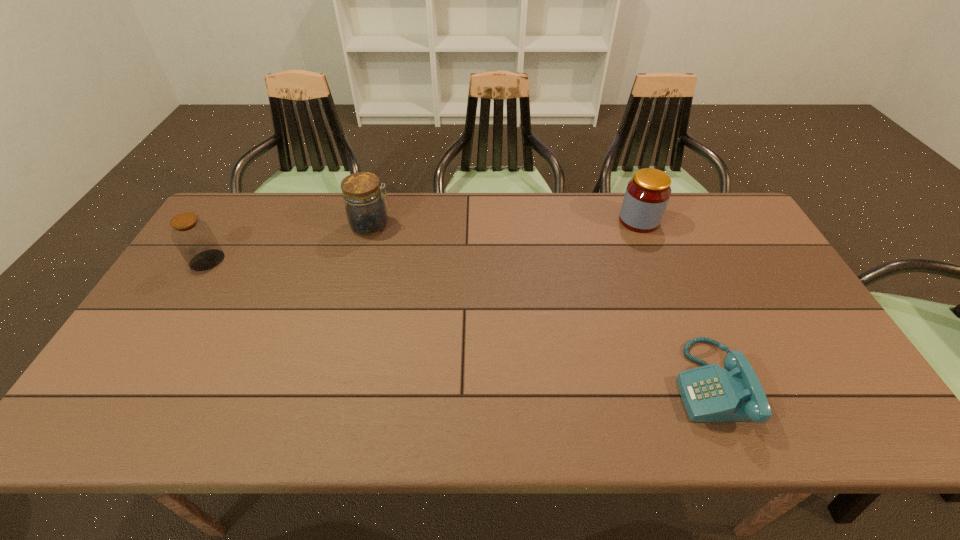
What are the coordinates of `vacant space at the far right corner of the desktop` in the screenshot? It's located at (685, 202).

This screenshot has width=960, height=540. In order to click on free space at the near right corner of the desktop in this screenshot , I will do `click(851, 404)`.

The height and width of the screenshot is (540, 960). Find the location of `free point between the second nearest object and the telephone`. free point between the second nearest object and the telephone is located at coordinates (459, 322).

Where is `free point between the nearest jar and the rightmost jar`? This screenshot has height=540, width=960. free point between the nearest jar and the rightmost jar is located at coordinates pos(423,240).

At what (x,y) coordinates should I click in order to perform the action: click on free space that is in between the shortest object and the nearest jar. Please return your answer as a coordinate pair (x, y). The image size is (960, 540). Looking at the image, I should click on (459, 322).

Where is `free space between the second object from left to right and the leftmost object`? The height and width of the screenshot is (540, 960). free space between the second object from left to right and the leftmost object is located at coordinates (289, 243).

Where is `free space that is in between the rightmost jar and the second object from left to right`? This screenshot has height=540, width=960. free space that is in between the rightmost jar and the second object from left to right is located at coordinates (505, 223).

The width and height of the screenshot is (960, 540). In order to click on free point between the nearest object and the rightmost jar in this screenshot , I will do `click(675, 302)`.

I want to click on vacant area that lies between the rightmost jar and the shortest object, so click(x=675, y=302).

Where is `unoccupied area between the second object from left to right and the shortest object`? Image resolution: width=960 pixels, height=540 pixels. unoccupied area between the second object from left to right and the shortest object is located at coordinates (541, 304).